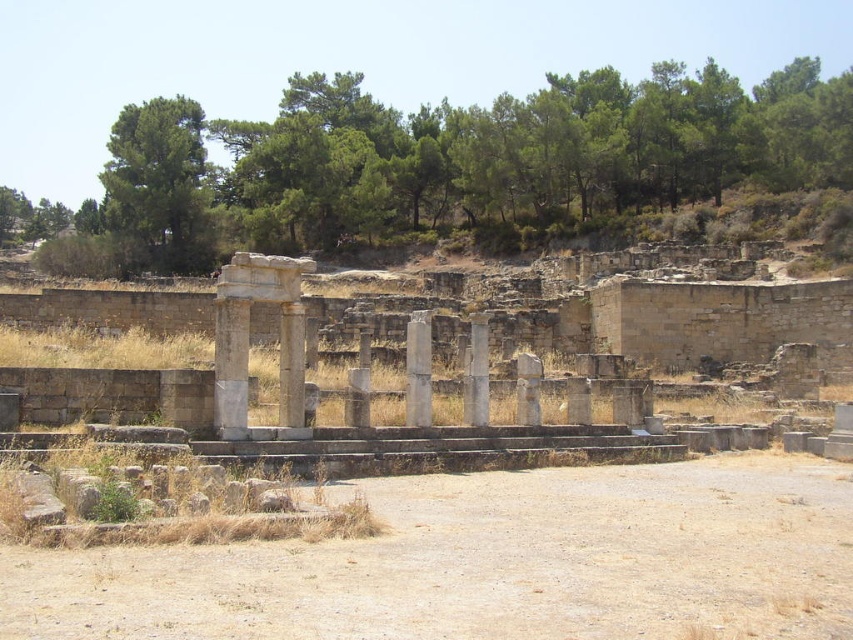
Question: Observing the image, what is the correct spatial positioning of white stone column at center in reference to gray stone pillar at center?

Choices:
 (A) below
 (B) above

Answer: (A)

Question: Which object is closer to the camera taking this photo?

Choices:
 (A) white marble column at center
 (B) gray stone pillar at center

Answer: (B)

Question: Which point is farther to the camera?

Choices:
 (A) (303, 342)
 (B) (422, 400)
 (C) (364, 182)

Answer: (C)

Question: Does green leafy trees at upper center have a lesser width compared to green leafy tree at upper left?

Choices:
 (A) yes
 (B) no

Answer: (B)

Question: Where is white marble pillar at center located in relation to gray stone pillar at center in the image?

Choices:
 (A) left
 (B) right

Answer: (A)

Question: Which of the following is the farthest from the observer?

Choices:
 (A) gray stone pillar at center
 (B) white marble column at center
 (C) white stone column at center

Answer: (B)